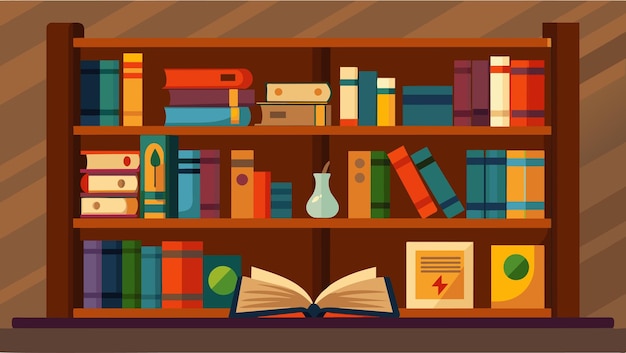
This screenshot has width=626, height=353. I want to click on books laying down flat on case, so click(x=218, y=78), click(x=216, y=93), click(x=217, y=109), click(x=282, y=90), click(x=285, y=112), click(x=331, y=299), click(x=116, y=155), click(x=111, y=179), click(x=106, y=201).